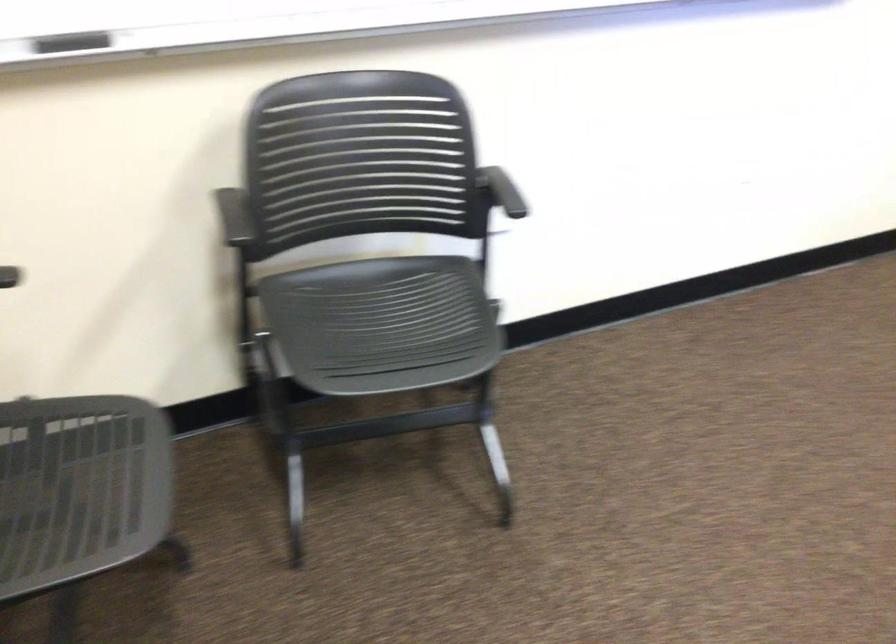
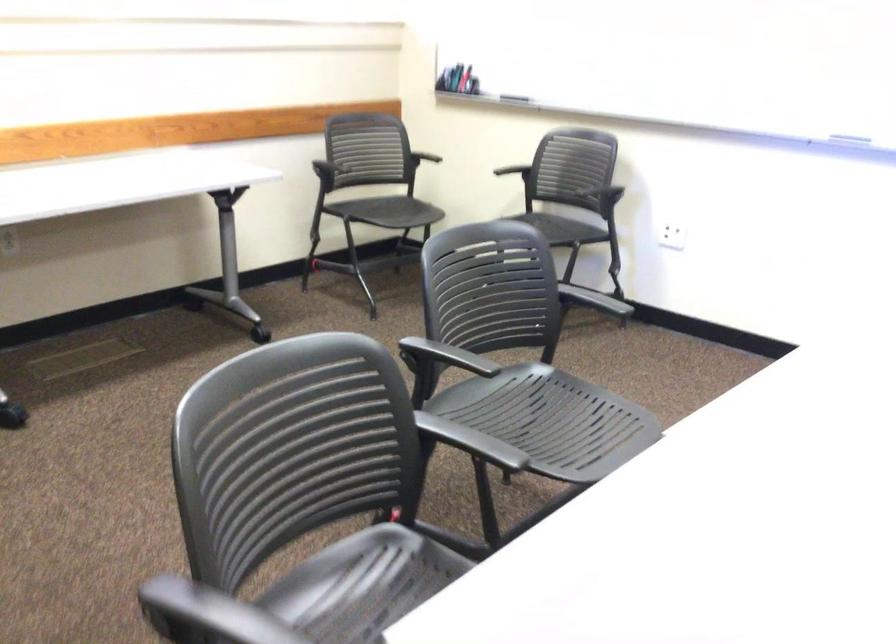
Find the pixel in the second image that matches (x=78, y=73) in the first image.

(514, 98)